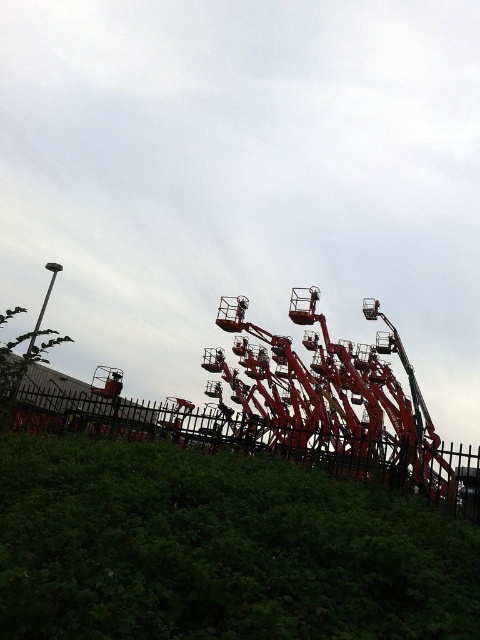
You are a maintenance worker needing to inspect both the metallic orange amusement park ride at center and the metallic red amusement ride at center. Given that your inspection tool has a 2 meter reach, can you reach both rides from your current position without moving?

The metallic orange amusement park ride at center and metallic red amusement ride at center are 1.86 meters apart from each other. Since your tool has a 2 meter reach, you can reach both rides without moving as the distance between them is within the tool reach.

Based on the photo, you are planning to set up a new ride in the amusement park. You have two options between the metallic orange amusement park ride at center and the metallic red amusement ride at center. Considering the space available, which one requires more space to accommodate its width?

The metallic orange amusement park ride at center requires more space because its width is larger than the metallic red amusement ride at center.

You are a maintenance worker assessing the placement of the metallic orange amusement park ride at center and the metallic red amusement ride at center. Which one is positioned higher in the image?

The metallic orange amusement park ride at center is located above the metallic red amusement ride at center, so it is positioned higher.